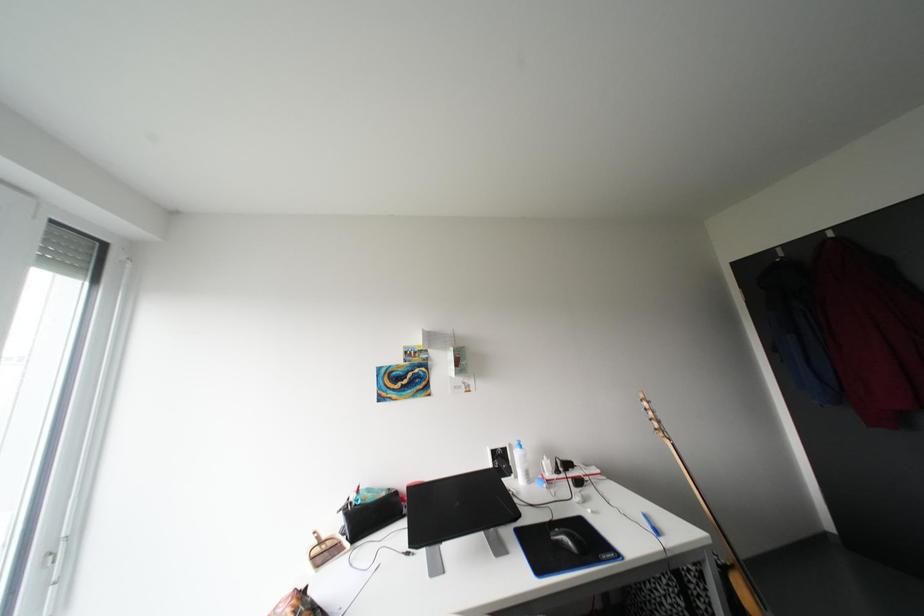
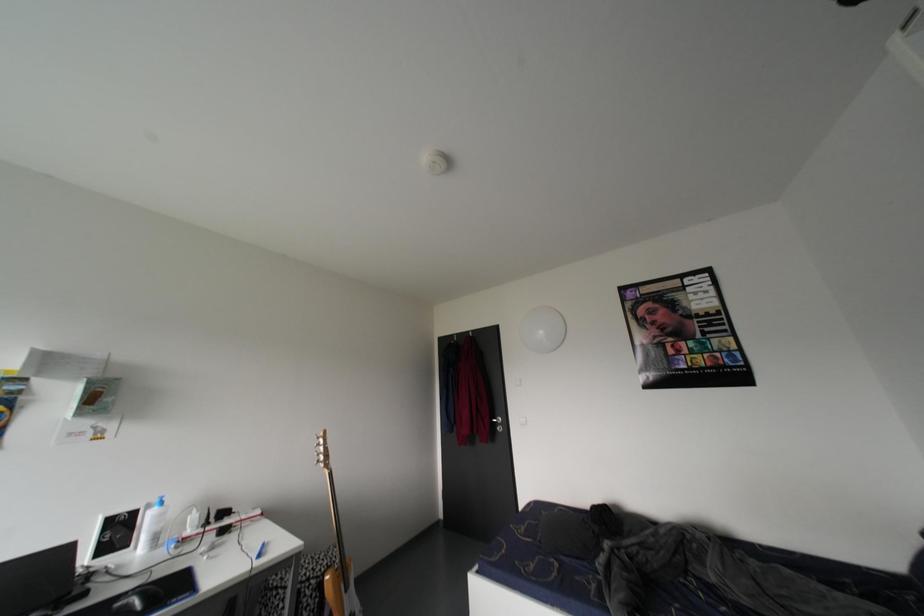
Question: The first image is from the beginning of the video and the second image is from the end. How did the camera likely rotate when shooting the video?

Choices:
 (A) Left
 (B) Right
 (C) Up
 (D) Down

Answer: (B)